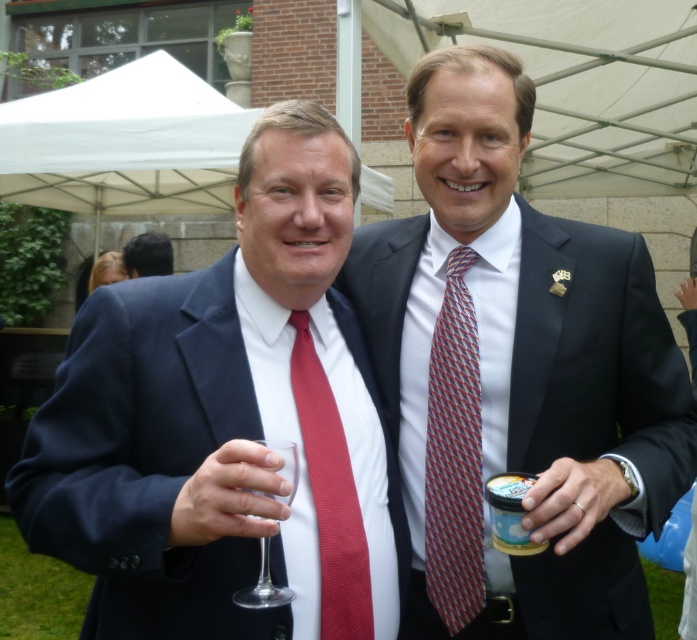
You are at a formal event and see a white plastic cup at right and dark brown hair at center. Which object is positioned lower in the image?

The white plastic cup at right is located below dark brown hair at center, so it is positioned lower in the image.

You are a photographer at a formal event and need to adjust the lighting to ensure both the matte red tie at left and the multicolored woven tie at center are visible. Given their sizes, which tie might require more focused lighting to avoid being overshadowed?

The matte red tie at left is much taller than the multicolored woven tie at center, so it may require more focused lighting to ensure its details are captured clearly without overshadowing the smaller tie.